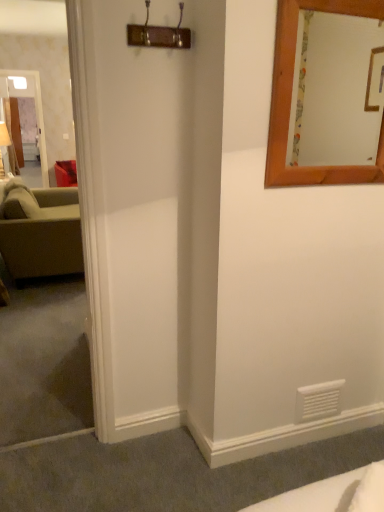
Question: Does clear glass door at left have a larger size compared to wooden-framed mirror at upper right?

Choices:
 (A) no
 (B) yes

Answer: (B)

Question: Does clear glass door at left have a greater height compared to wooden-framed mirror at upper right?

Choices:
 (A) yes
 (B) no

Answer: (A)

Question: Does clear glass door at left appear on the right side of wooden-framed mirror at upper right?

Choices:
 (A) no
 (B) yes

Answer: (A)

Question: From a real-world perspective, is clear glass door at left beneath wooden-framed mirror at upper right?

Choices:
 (A) no
 (B) yes

Answer: (B)

Question: From a real-world perspective, is clear glass door at left located higher than wooden-framed mirror at upper right?

Choices:
 (A) no
 (B) yes

Answer: (A)

Question: Is there a large distance between clear glass door at left and wooden-framed mirror at upper right?

Choices:
 (A) no
 (B) yes

Answer: (B)

Question: Considering the relative sizes of clear glass door at left and green fabric couch at left in the image provided, is clear glass door at left wider than green fabric couch at left?

Choices:
 (A) no
 (B) yes

Answer: (A)

Question: Is clear glass door at left positioned far away from green fabric couch at left?

Choices:
 (A) no
 (B) yes

Answer: (B)

Question: From the image's perspective, is clear glass door at left on top of green fabric couch at left?

Choices:
 (A) yes
 (B) no

Answer: (A)

Question: Is clear glass door at left bigger than green fabric couch at left?

Choices:
 (A) no
 (B) yes

Answer: (A)

Question: Is the position of clear glass door at left more distant than that of green fabric couch at left?

Choices:
 (A) no
 (B) yes

Answer: (B)

Question: Is clear glass door at left facing towards green fabric couch at left?

Choices:
 (A) no
 (B) yes

Answer: (B)

Question: Is green fabric couch at left positioned before wooden-framed mirror at upper right?

Choices:
 (A) no
 (B) yes

Answer: (A)